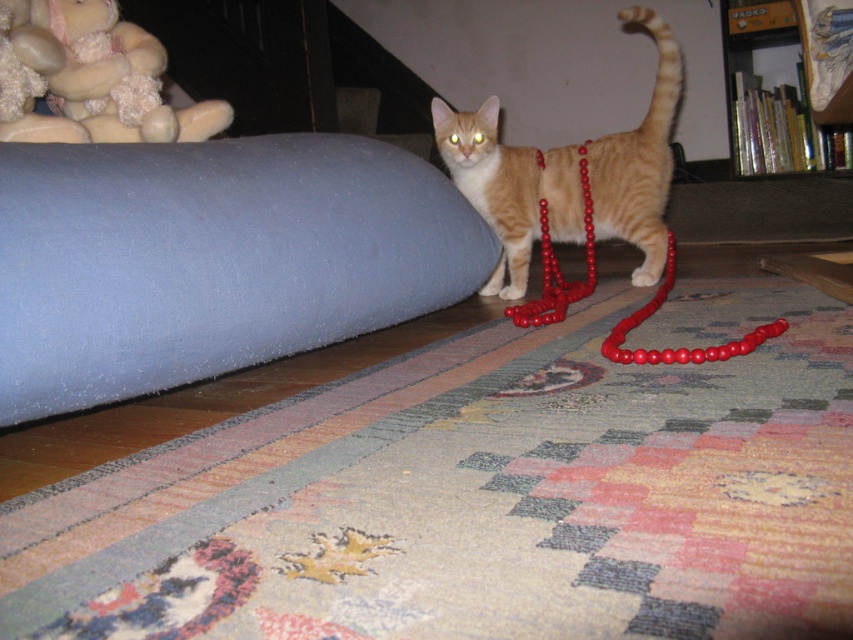
Is point (473, 134) closer to camera compared to point (9, 20)?

No, (473, 134) is behind (9, 20).

I want to click on orange fur cat at center, so click(x=509, y=188).

Image resolution: width=853 pixels, height=640 pixels. I want to click on orange fur cat at center, so click(x=509, y=188).

The height and width of the screenshot is (640, 853). What do you see at coordinates (90, 77) in the screenshot?
I see `soft beige plush at upper left` at bounding box center [90, 77].

Does soft beige plush at upper left have a greater width compared to red beaded necklace at center?

Yes, soft beige plush at upper left is wider than red beaded necklace at center.

Measure the distance between point (64, 131) and camera.

They are 5.07 feet apart.

Locate an element on the screen. The width and height of the screenshot is (853, 640). soft beige plush at upper left is located at coordinates coord(90,77).

Who is more distant from viewer, (589, 188) or (587, 221)?

The point (589, 188) is more distant.

Who is more forward, (589,266) or (514,305)?

Positioned in front is point (514,305).

The width and height of the screenshot is (853, 640). I want to click on red beads at center, so click(x=556, y=262).